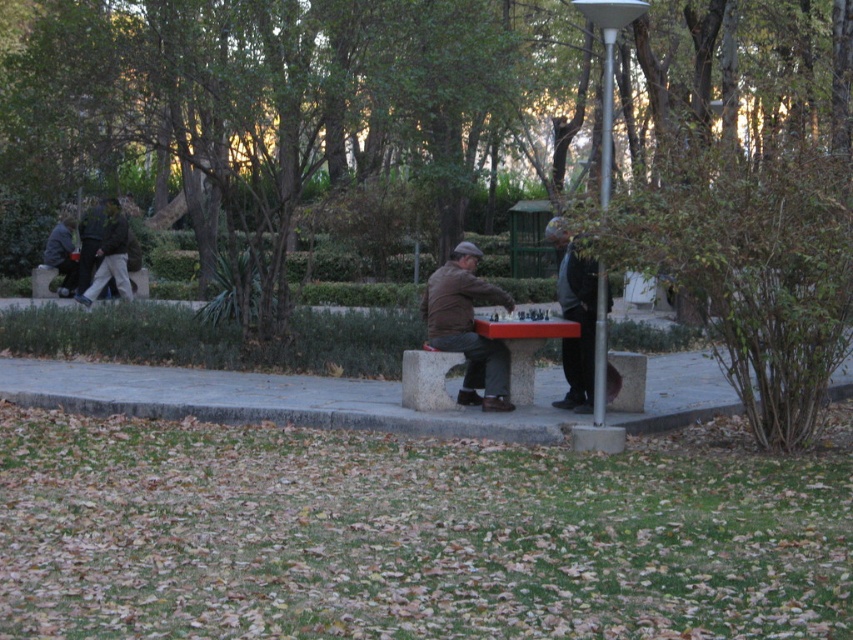
Question: Can you confirm if brown leather jacket at center is thinner than dark brown leather jacket at left?

Choices:
 (A) no
 (B) yes

Answer: (B)

Question: Can you confirm if green leafy tree at center is positioned above dark brown leather jacket at center?

Choices:
 (A) no
 (B) yes

Answer: (B)

Question: Which point is farther to the camera?

Choices:
 (A) wooden bench at center
 (B) green leafy tree at center
 (C) dark brown leather jacket at center

Answer: (A)

Question: Which object appears closest to the camera in this image?

Choices:
 (A) red plastic table at center
 (B) dark brown leather jacket at left

Answer: (A)

Question: Which of the following is the farthest from the observer?

Choices:
 (A) dark brown leather jacket at center
 (B) green leafy tree at center

Answer: (A)

Question: Is dark brown leather jacket at center positioned at the back of red plastic table at center?

Choices:
 (A) no
 (B) yes

Answer: (B)